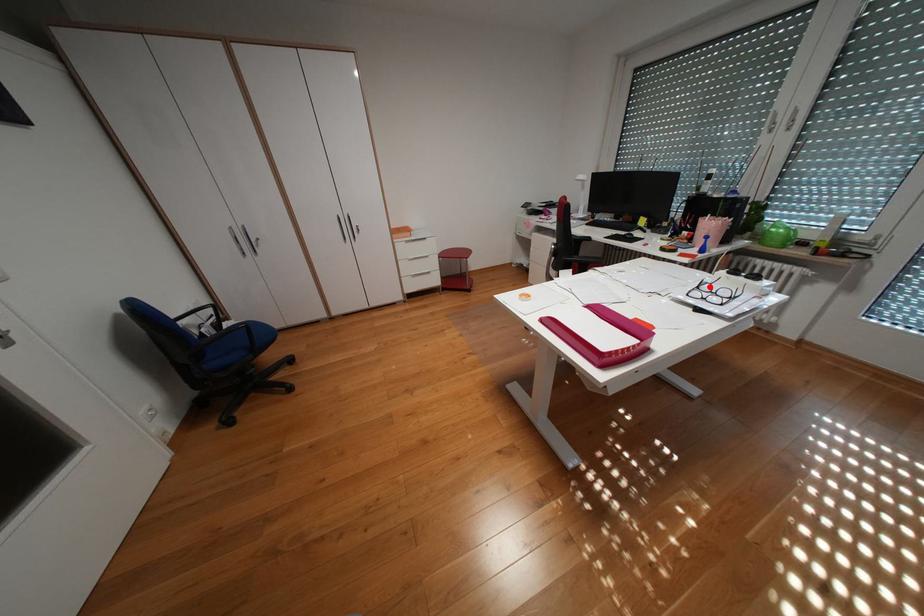
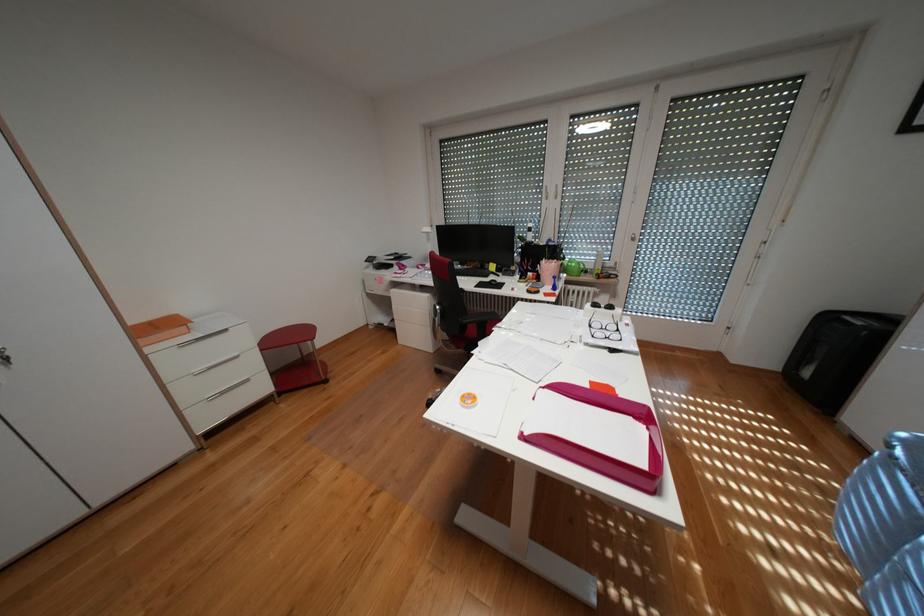
In the second image, find the point that corresponds to the highlighted location in the first image.

(602, 325)